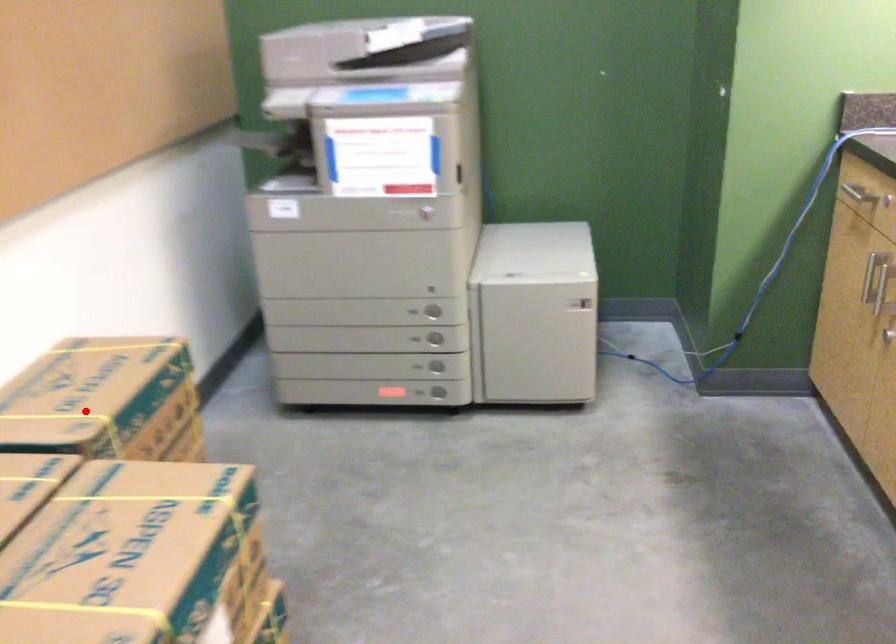
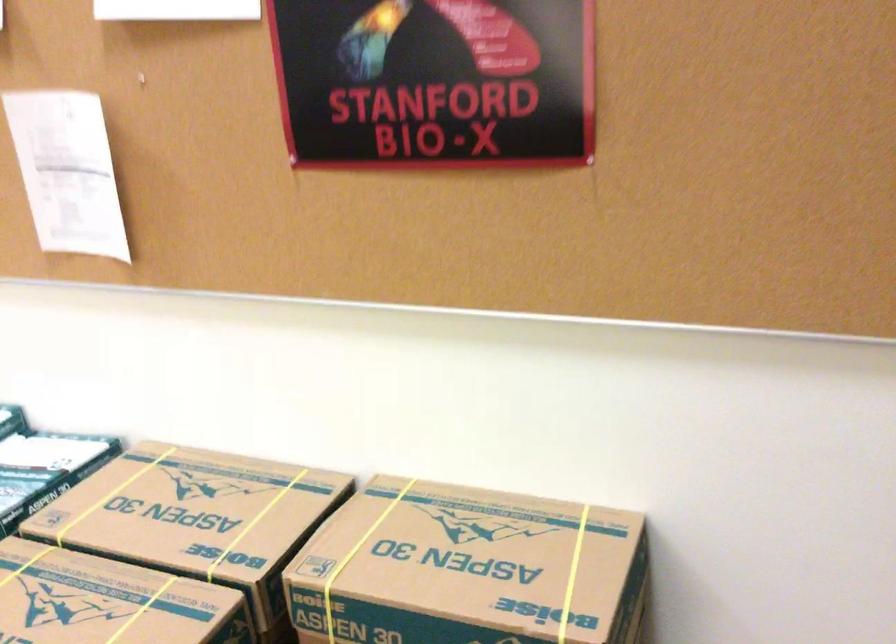
Question: I am providing you with two images of the same scene from different viewpoints. In image1, a red point is highlighted. Considering the same 3D point in image2, which of the following is correct?

Choices:
 (A) It is closer
 (B) It is farther

Answer: (A)